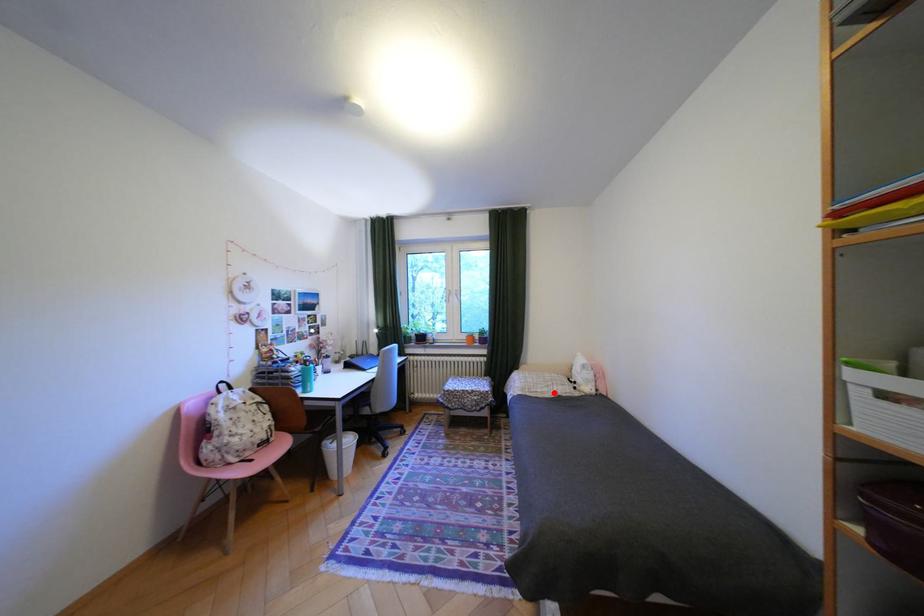
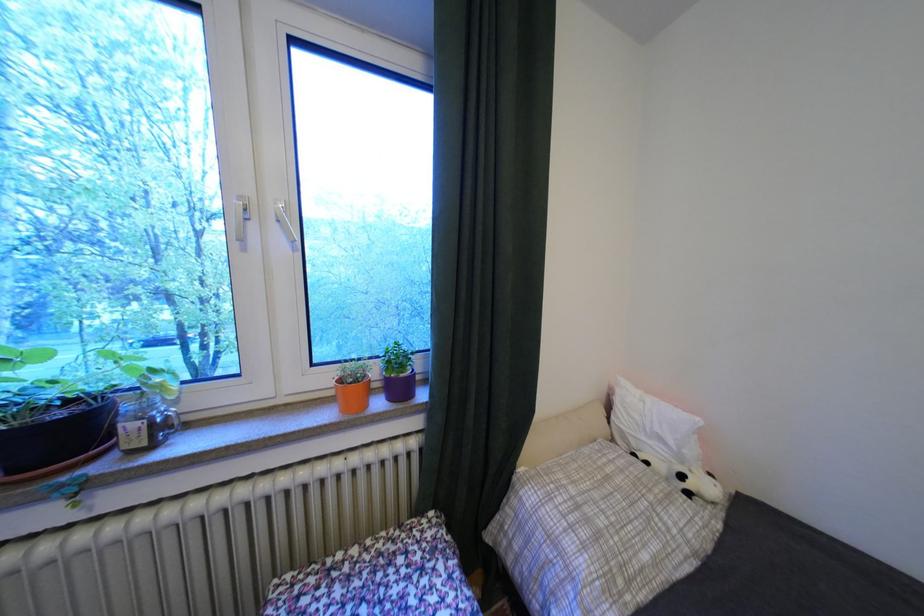
Question: I am providing you with two images of the same scene from different viewpoints. Given a red point in image1, look at the same physical point in image2. Is it:

Choices:
 (A) Closer to the viewpoint
 (B) Farther from the viewpoint

Answer: (A)